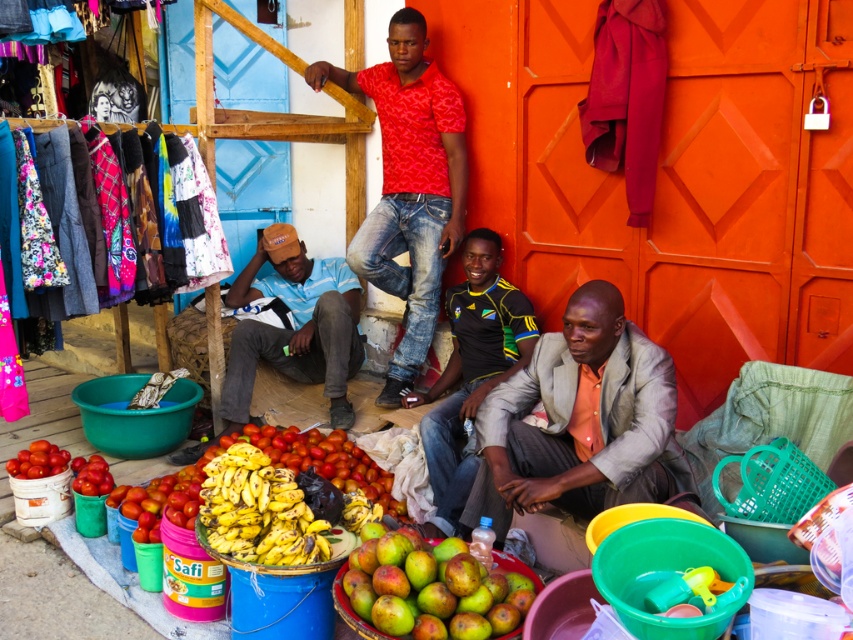
You are standing in the street market and want to find the red printed shirt at center. According to the coordinates given, where should you look to find it?

The red printed shirt at center is located at coordinates point (408, 186).

You are a customer looking to buy a mango. You see the red printed shirt at center and the green matte mangoes at lower center. Which item is positioned higher up compared to the other?

The red printed shirt at center is taller than the green matte mangoes at lower center, so the red printed shirt at center is positioned higher up.